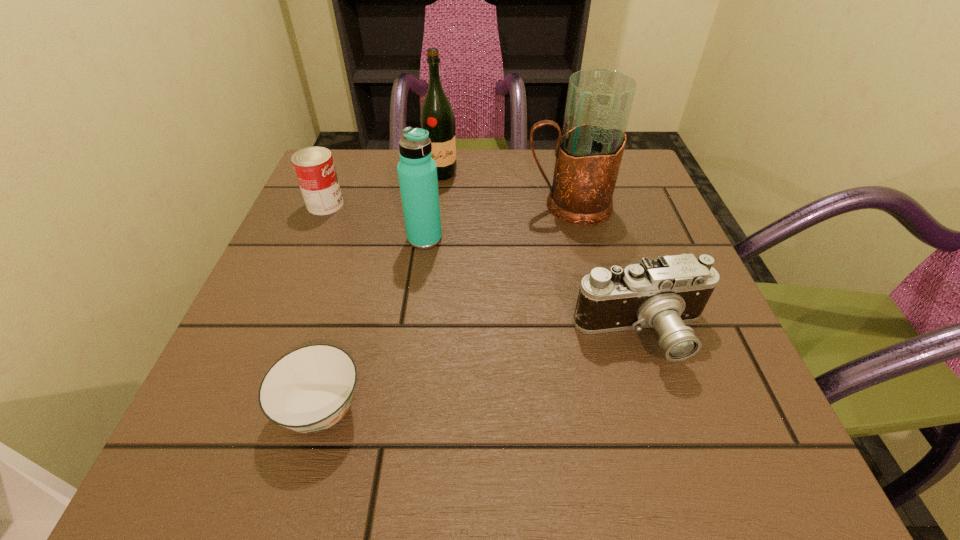
Where is `can that is at the left edge`? This screenshot has width=960, height=540. can that is at the left edge is located at coordinates (314, 167).

At what (x,y) coordinates should I click in order to perform the action: click on soup bowl that is at the left edge. Please return your answer as a coordinate pair (x, y). This screenshot has width=960, height=540. Looking at the image, I should click on (308, 390).

Find the location of a particular element. pitcher that is at the right edge is located at coordinates (589, 151).

You are a GUI agent. You are given a task and a screenshot of the screen. Output one action in this format:
    pyautogui.click(x=<x>, y=<y>)
    Task: Click on the camera positioned at the right edge
    
    Given the screenshot: What is the action you would take?
    pyautogui.click(x=664, y=293)

Find the location of a particular element. The width and height of the screenshot is (960, 540). object that is positioned at the far left corner is located at coordinates (314, 167).

The image size is (960, 540). What are the coordinates of `object that is at the near left corner` in the screenshot? It's located at (308, 390).

Locate an element on the screen. The image size is (960, 540). object that is at the far right corner is located at coordinates (589, 151).

You are a GUI agent. You are given a task and a screenshot of the screen. Output one action in this format:
    pyautogui.click(x=<x>, y=<y>)
    Task: Click on the free spot at the far edge of the desktop
    This screenshot has height=540, width=960.
    Given the screenshot: What is the action you would take?
    pyautogui.click(x=535, y=194)

Identify the location of vacant space at the near edge. This screenshot has width=960, height=540. click(x=513, y=428).

Image resolution: width=960 pixels, height=540 pixels. In the image, there is a desktop. Find the location of `vacant region at the left edge`. vacant region at the left edge is located at coordinates (355, 240).